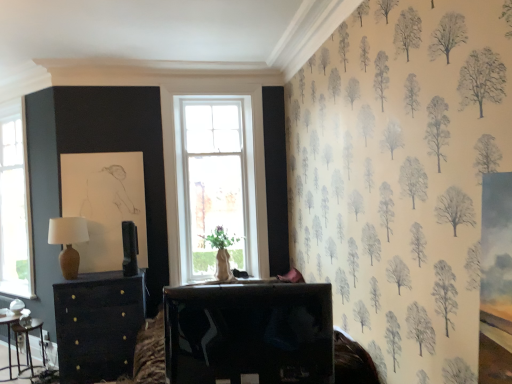
Question: Is shiny black tv at center, placed as the first table when sorted from front to back, positioned with its back to metallic silver table at lower left, the second table from the front?

Choices:
 (A) yes
 (B) no

Answer: (B)

Question: Is shiny black tv at center, arranged as the first table when viewed from the right, outside metallic silver table at lower left, the second table positioned from the back?

Choices:
 (A) no
 (B) yes

Answer: (B)

Question: From a real-world perspective, is shiny black tv at center, which is the third table from left to right, physically above metallic silver table at lower left, the second table from the front?

Choices:
 (A) yes
 (B) no

Answer: (A)

Question: Is shiny black tv at center, arranged as the first table when viewed from the right, aimed at metallic silver table at lower left, marked as the third table in a right-to-left arrangement?

Choices:
 (A) no
 (B) yes

Answer: (A)

Question: Can you confirm if shiny black tv at center, which is the third table from left to right, is thinner than metallic silver table at lower left, positioned as the 1th table in left-to-right order?

Choices:
 (A) yes
 (B) no

Answer: (A)

Question: Considering the relative positions of matte brown table lamp at left and metallic silver table at lower left, marked as the third table in a right-to-left arrangement, in the image provided, is matte brown table lamp at left to the left or to the right of metallic silver table at lower left, marked as the third table in a right-to-left arrangement,?

Choices:
 (A) right
 (B) left

Answer: (A)

Question: Is point (59, 233) closer or farther from the camera than point (4, 314)?

Choices:
 (A) closer
 (B) farther

Answer: (B)

Question: Is matte brown table lamp at left bigger or smaller than metallic silver table at lower left, the second table from the front?

Choices:
 (A) small
 (B) big

Answer: (A)

Question: From a real-world perspective, relative to metallic silver table at lower left, the second table from the front, is matte brown table lamp at left vertically above or below?

Choices:
 (A) above
 (B) below

Answer: (A)

Question: Is matte brown table lamp at left to the left or to the right of matte black chest of drawers at left in the image?

Choices:
 (A) left
 (B) right

Answer: (A)

Question: From the image's perspective, is matte brown table lamp at left above or below matte black chest of drawers at left?

Choices:
 (A) above
 (B) below

Answer: (A)

Question: Choose the correct answer: Is matte brown table lamp at left inside matte black chest of drawers at left or outside it?

Choices:
 (A) inside
 (B) outside

Answer: (B)

Question: Based on their sizes in the image, would you say matte brown table lamp at left is bigger or smaller than matte black chest of drawers at left?

Choices:
 (A) big
 (B) small

Answer: (B)

Question: Considering the positions of matte black chest of drawers at left and matte brown table lamp at left in the image, is matte black chest of drawers at left bigger or smaller than matte brown table lamp at left?

Choices:
 (A) small
 (B) big

Answer: (B)

Question: From the image's perspective, relative to matte brown table lamp at left, is matte black chest of drawers at left above or below?

Choices:
 (A) below
 (B) above

Answer: (A)